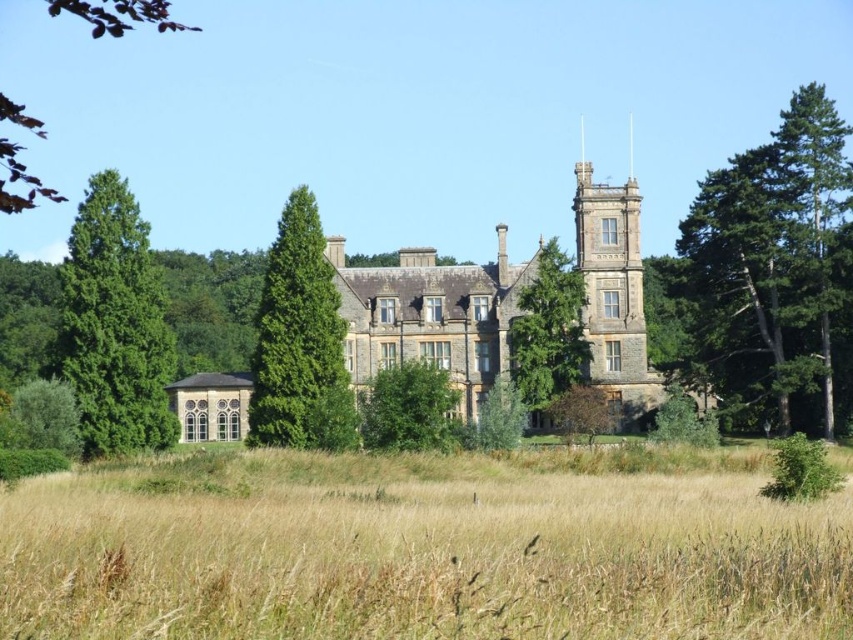
Question: Among these points, which one is nearest to the camera?

Choices:
 (A) (22, 189)
 (B) (265, 307)

Answer: (B)

Question: Among these objects, which one is nearest to the camera?

Choices:
 (A) green leafy tree at lower left
 (B) green leafy tree at center
 (C) dry grass at center
 (D) green textured pine tree at right

Answer: (C)

Question: Can you confirm if green coniferous tree at right is wider than green leafy tree at lower left?

Choices:
 (A) yes
 (B) no

Answer: (A)

Question: Where is green textured tree at center located in relation to green leafy tree at lower left in the image?

Choices:
 (A) below
 (B) above

Answer: (B)

Question: Is green coniferous tree at right positioned behind green textured tree at upper left?

Choices:
 (A) yes
 (B) no

Answer: (A)

Question: Which point appears farthest from the camera in this image?

Choices:
 (A) (447, 291)
 (B) (808, 116)

Answer: (A)